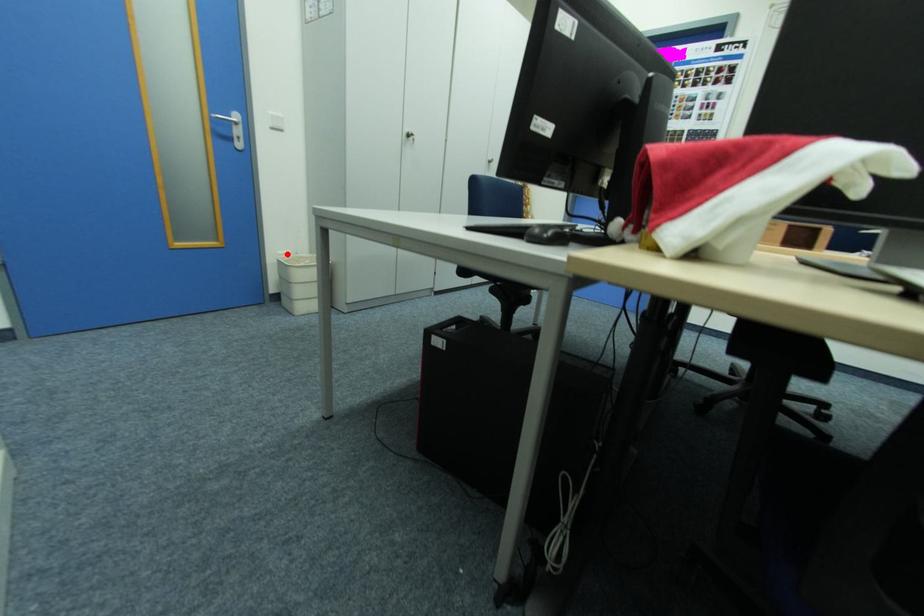
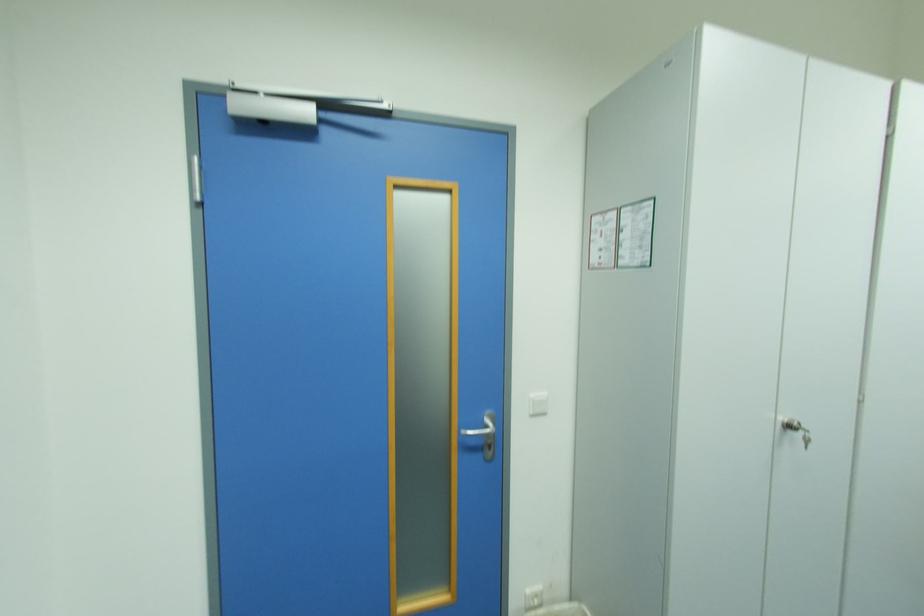
Question: I am providing you with two images of the same scene from different viewpoints. Given a red point in image1, look at the same physical point in image2. Is it:

Choices:
 (A) Closer to the viewpoint
 (B) Farther from the viewpoint

Answer: (A)